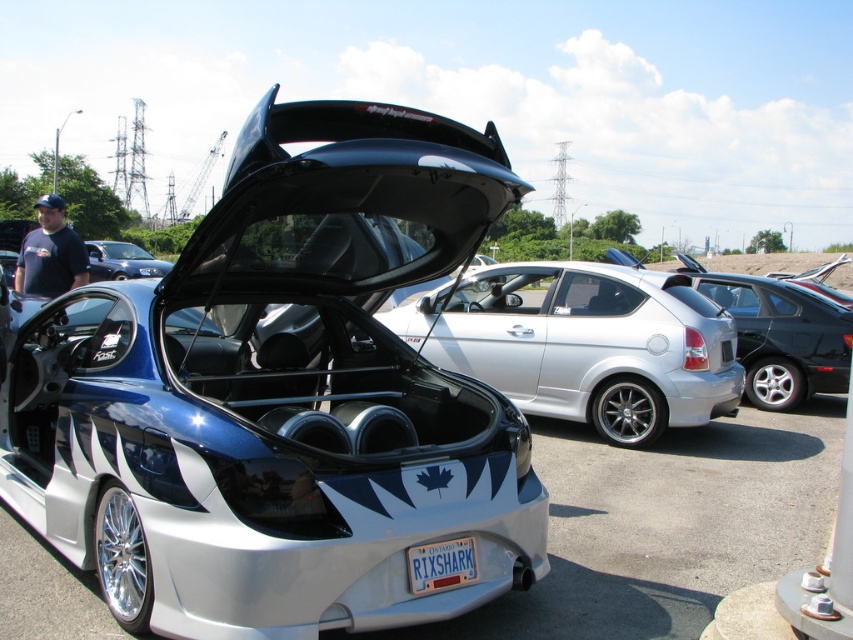
Who is more forward, (28, 285) or (460, 577)?

Point (460, 577)

Is dark blue t-shirt at left to the left of white plastic license plate at center from the viewer's perspective?

Yes, dark blue t-shirt at left is to the left of white plastic license plate at center.

The image size is (853, 640). Identify the location of dark blue t-shirt at left. (50, 253).

Image resolution: width=853 pixels, height=640 pixels. I want to click on dark blue t-shirt at left, so click(50, 253).

Can you confirm if silver metallic hatchback at center is thinner than dark blue t-shirt at left?

Yes, silver metallic hatchback at center is thinner than dark blue t-shirt at left.

Who is more distant from viewer, (607, 353) or (39, 198)?

The point (39, 198) is more distant.

Describe the element at coordinates (582, 342) in the screenshot. The height and width of the screenshot is (640, 853). I see `silver metallic hatchback at center` at that location.

Locate an element on the screen. This screenshot has width=853, height=640. silver metallic hatchback at center is located at coordinates (582, 342).

Is silver metallic hatchback at center bigger than shiny metallic sedan at center?

No, silver metallic hatchback at center is not bigger than shiny metallic sedan at center.

Does silver metallic hatchback at center have a smaller size compared to shiny metallic sedan at center?

Indeed, silver metallic hatchback at center has a smaller size compared to shiny metallic sedan at center.

The width and height of the screenshot is (853, 640). What do you see at coordinates (582, 342) in the screenshot?
I see `silver metallic hatchback at center` at bounding box center [582, 342].

Where is `silver metallic hatchback at center`? This screenshot has height=640, width=853. silver metallic hatchback at center is located at coordinates (582, 342).